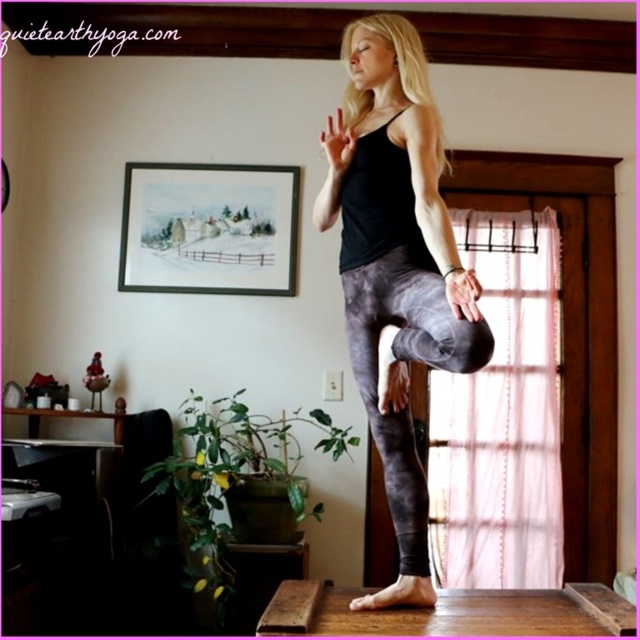
Is black matte tank top at center wider than gray marbled leggings at center?

Correct, the width of black matte tank top at center exceeds that of gray marbled leggings at center.

Between point (404, 520) and point (477, 336), which one is positioned in front?

Point (477, 336) is more forward.

What are the coordinates of `black matte tank top at center` in the screenshot? It's located at (396, 266).